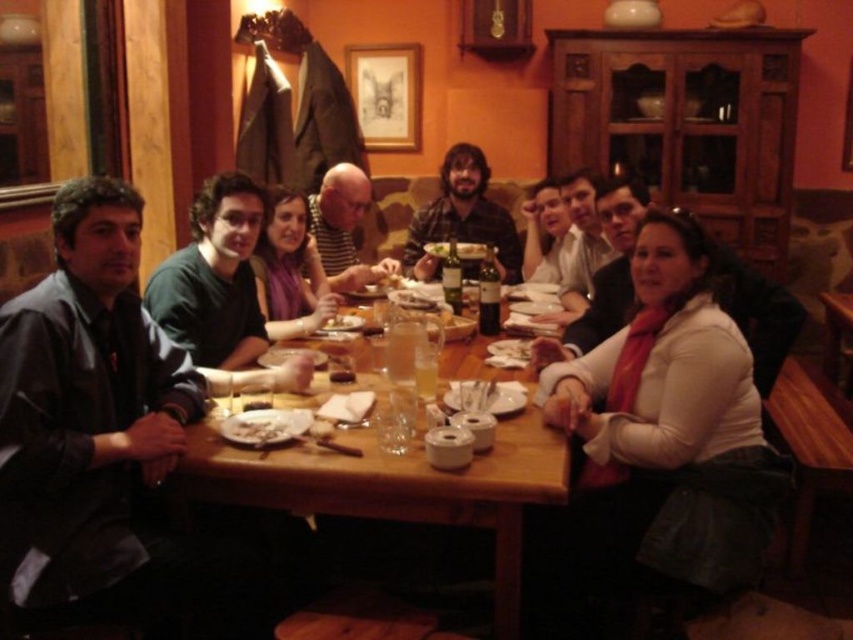
Question: Estimate the real-world distances between objects in this image. Which object is closer to the white matte scarf at right?

Choices:
 (A) white scarf at center
 (B) matte black shirt at center

Answer: (A)

Question: Which point is farther to the camera?

Choices:
 (A) white creamy sauce at table center
 (B) dark green shirt at center
 (C) white matte scarf at right
 (D) matte purple scarf at center

Answer: (D)

Question: Does black matte shirt at left have a smaller size compared to wooden table at center?

Choices:
 (A) yes
 (B) no

Answer: (A)

Question: From the image, what is the correct spatial relationship of wooden table at center in relation to white creamy sauce at table center?

Choices:
 (A) left
 (B) right

Answer: (B)

Question: Which point appears farthest from the camera in this image?

Choices:
 (A) (288, 426)
 (B) (577, 196)
 (C) (196, 333)
 (D) (645, 321)

Answer: (B)

Question: Is matte purple scarf at center smaller than matte black shirt at center?

Choices:
 (A) yes
 (B) no

Answer: (A)